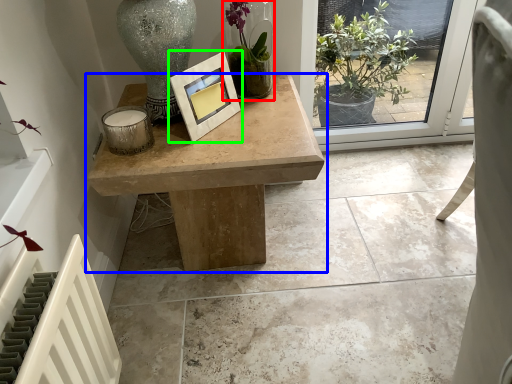
Question: Considering the real-world distances, which object is closest to houseplant (highlighted by a red box)? table (highlighted by a blue box) or picture frame (highlighted by a green box).

Choices:
 (A) table
 (B) picture frame

Answer: (B)